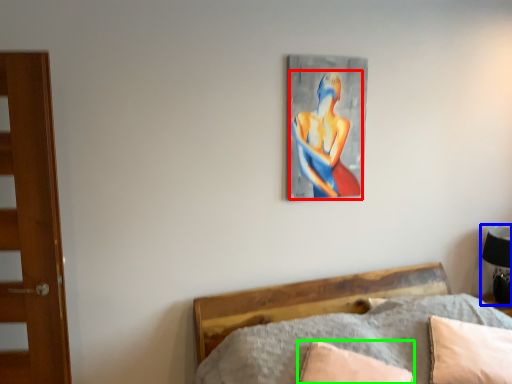
Question: Estimate the real-world distances between objects in this image. Which object is closer to person (highlighted by a red box), table lamp (highlighted by a blue box) or pillow (highlighted by a green box)?

Choices:
 (A) table lamp
 (B) pillow

Answer: (B)